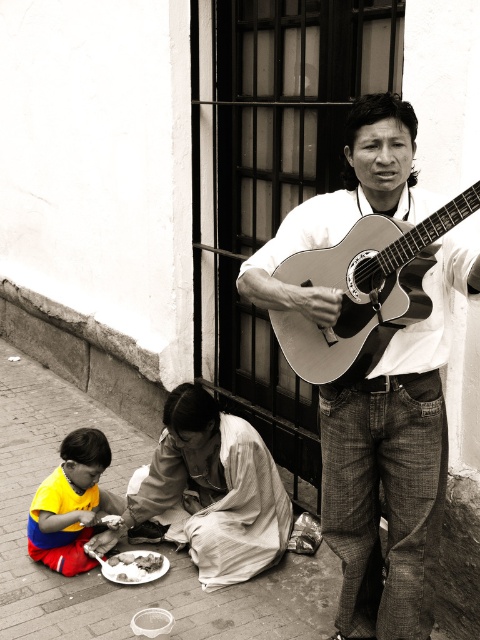
Question: Which object is farther from the camera taking this photo?

Choices:
 (A) wooden acoustic guitar at center
 (B) smooth wood guitar at center
 (C) brick pavement at lower left
 (D) yellow fabric shirt at lower left

Answer: (D)

Question: Which of the following is the farthest from the observer?

Choices:
 (A) (96, 529)
 (B) (336, 477)

Answer: (A)

Question: Can you confirm if brick pavement at lower left is thinner than wooden acoustic guitar at center?

Choices:
 (A) yes
 (B) no

Answer: (B)

Question: Does wooden acoustic guitar at center lie in front of white crumbly bread at lower left?

Choices:
 (A) yes
 (B) no

Answer: (A)

Question: Does smooth wood guitar at center lie in front of yellow fabric shirt at lower left?

Choices:
 (A) no
 (B) yes

Answer: (B)

Question: Which point appears closest to the camera in this image?

Choices:
 (A) (158, 406)
 (B) (55, 515)
 (C) (415, 115)

Answer: (C)